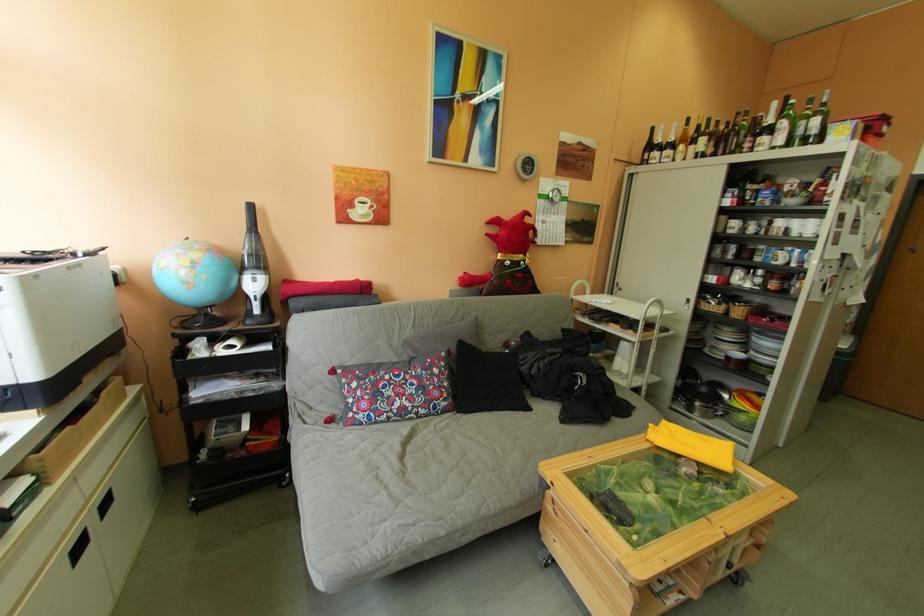
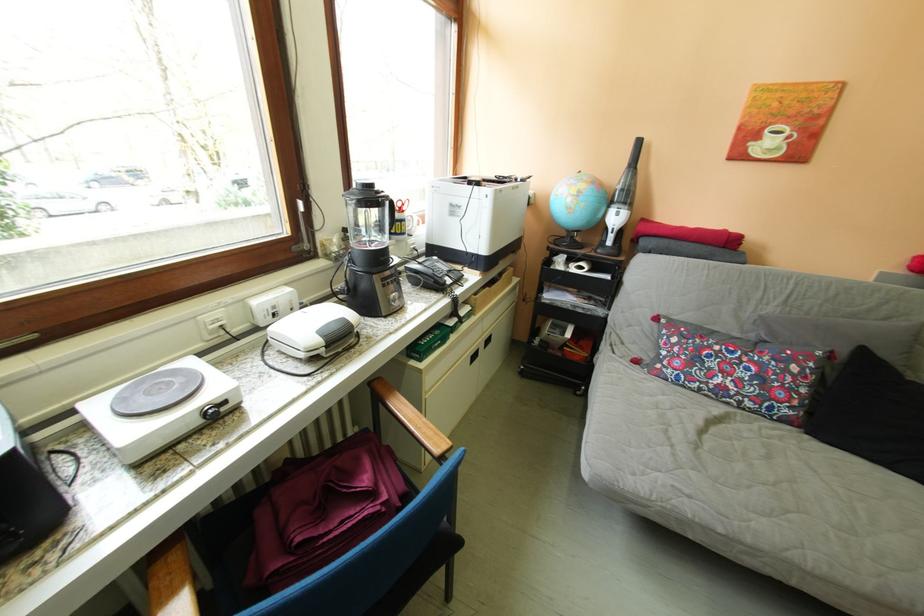
Find the pixel in the second image that matches point (470, 416) in the first image.

(821, 437)